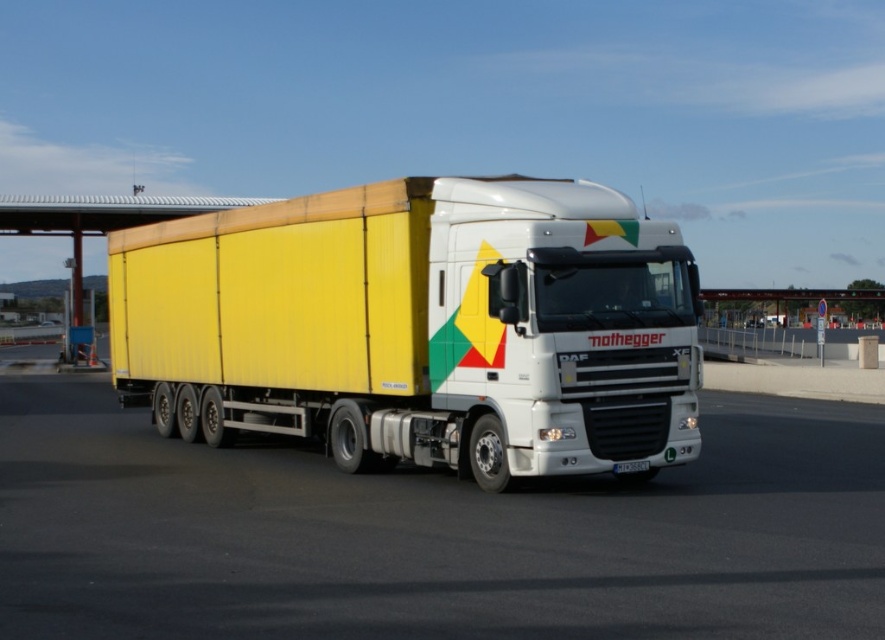
You are a truck driver who needs to park your vehicle in a tight space. You see the white glossy highway at center and the yellow matte trailer at center. Which one is wider?

The white glossy highway at center is wider than the yellow matte trailer at center according to the description.

You are a driver who needs to park your truck at a rest area. You see the white glossy highway at center and the yellow matte trailer at center. Which one is larger in size?

The yellow matte trailer at center is larger than the white glossy highway at center.